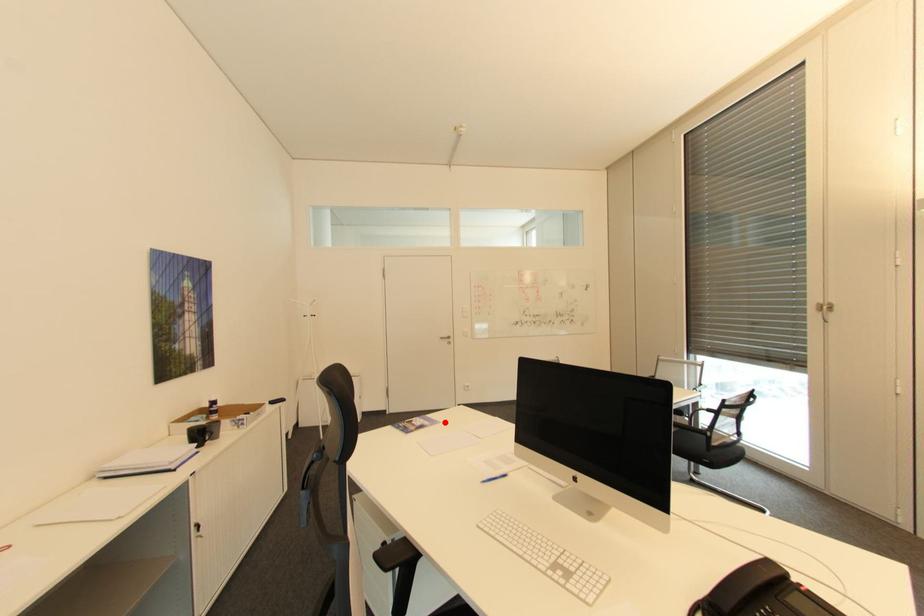
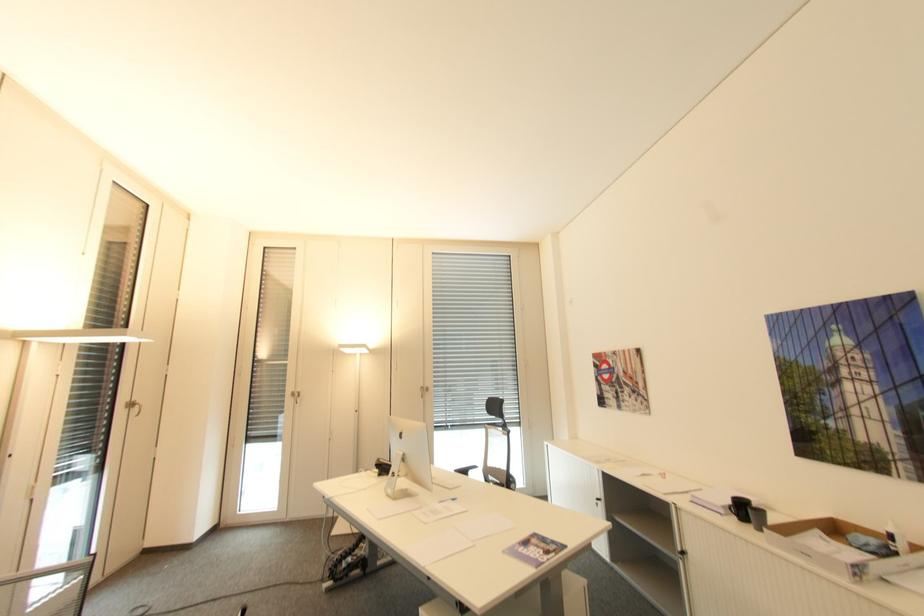
The point at the highlighted location is marked in the first image. Where is the corresponding point in the second image?

(507, 553)